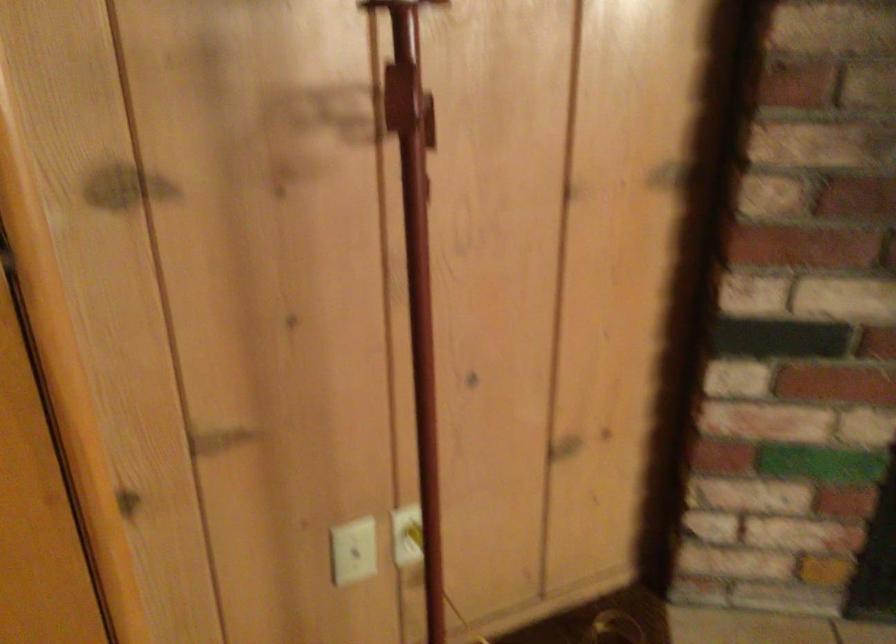
The width and height of the screenshot is (896, 644). Describe the element at coordinates (399, 98) in the screenshot. I see `a red lamp switch` at that location.